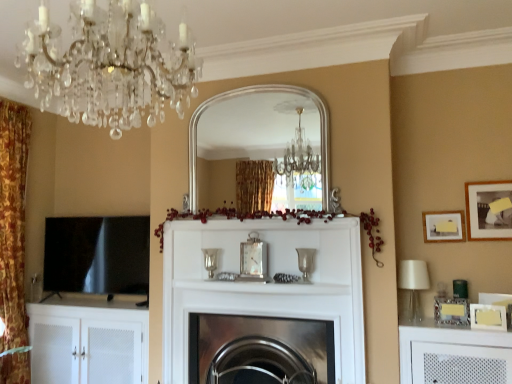
Image resolution: width=512 pixels, height=384 pixels. I want to click on vacant area situated below black glossy tv at left (from a real-world perspective), so click(x=88, y=297).